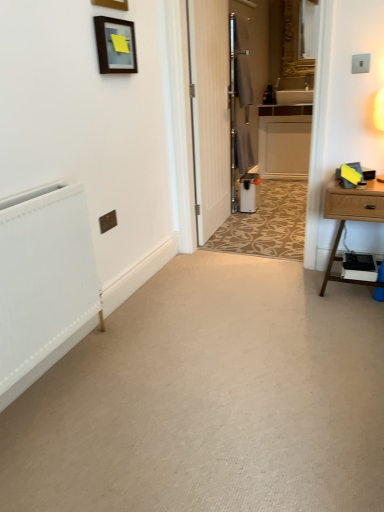
Where is `white plastic air purifier at center`? white plastic air purifier at center is located at coordinates (249, 192).

In order to face light brown wood nightstand at right, should I rotate leftwards or rightwards?

To align with it, rotate right about 21.555°.

What is the approximate height of metallic rectangular at left?

metallic rectangular at left is 3.66 inches in height.

Where is `metallic rectangular at left`? The height and width of the screenshot is (512, 384). metallic rectangular at left is located at coordinates (108, 221).

This screenshot has height=512, width=384. In order to click on gold ornate mirror at upper center in this screenshot , I will do `click(294, 42)`.

Does point (101, 1) come closer to viewer compared to point (305, 71)?

That is True.

Based on the photo, which of these two, matte wooden picture frame at upper center, placed as the second picture frame when sorted from bottom to top, or gold ornate mirror at upper center, is bigger?

gold ornate mirror at upper center is bigger.

How far apart are matte wooden picture frame at upper center, placed as the second picture frame when sorted from bottom to top, and gold ornate mirror at upper center?

They are 10.19 feet apart.

Would you say matte wooden picture frame at upper center, which is the 1th picture frame from top to bottom, is outside gold ornate mirror at upper center?

Yes, matte wooden picture frame at upper center, which is the 1th picture frame from top to bottom, is not within gold ornate mirror at upper center.

Is metallic rectangular at left at the left side of white plastic air purifier at center?

Yes, metallic rectangular at left is to the left of white plastic air purifier at center.

Based on the photo, is white plastic air purifier at center at the back of metallic rectangular at left?

metallic rectangular at left does not have its back to white plastic air purifier at center.

Considering the sizes of metallic rectangular at left and white plastic air purifier at center in the image, is metallic rectangular at left wider or thinner than white plastic air purifier at center?

metallic rectangular at left is thinner than white plastic air purifier at center.

Between metallic rectangular at left and white plastic air purifier at center, which one has smaller size?

With smaller size is metallic rectangular at left.

In terms of height, does light brown wood nightstand at right look taller or shorter compared to metallic rectangular at left?

Considering their sizes, light brown wood nightstand at right has more height than metallic rectangular at left.

Does light brown wood nightstand at right lie in front of metallic rectangular at left?

Yes, it is in front of metallic rectangular at left.

Is light brown wood nightstand at right aimed at metallic rectangular at left?

No, light brown wood nightstand at right is not facing towards metallic rectangular at left.

Visually, is light brown wood nightstand at right positioned to the left or to the right of metallic rectangular at left?

In the image, light brown wood nightstand at right appears on the right side of metallic rectangular at left.

Does gold ornate mirror at upper center turn towards white plastic air purifier at center?

No, gold ornate mirror at upper center is not aimed at white plastic air purifier at center.

Is there a large distance between gold ornate mirror at upper center and white plastic air purifier at center?

Yes, gold ornate mirror at upper center and white plastic air purifier at center are quite far apart.

Find the location of a particular element. The width and height of the screenshot is (384, 512). appliance located underneath the gold ornate mirror at upper center (from a real-world perspective) is located at coordinates (249, 192).

Is white plastic air purifier at center completely or partially inside gold ornate mirror at upper center?

No, white plastic air purifier at center is not a part of gold ornate mirror at upper center.

Considering the relative positions of light brown wood nightstand at right and white plastic air purifier at center in the image provided, is light brown wood nightstand at right behind white plastic air purifier at center?

No, it is in front of white plastic air purifier at center.

You are a GUI agent. You are given a task and a screenshot of the screen. Output one action in this format:
    pyautogui.click(x=<x>, y=<y>)
    Task: Click on the nightstand that appears on the right of white plastic air purifier at center
    The height and width of the screenshot is (512, 384).
    Given the screenshot: What is the action you would take?
    pyautogui.click(x=351, y=218)

Is white textured radiator at left not close to silver metallic screen door at center?

Yes, white textured radiator at left and silver metallic screen door at center are quite far apart.

Choose the correct answer: Is white textured radiator at left inside silver metallic screen door at center or outside it?

white textured radiator at left is located beyond the bounds of silver metallic screen door at center.

Which of these two, white textured radiator at left or silver metallic screen door at center, is bigger?

Bigger between the two is white textured radiator at left.

Which of these two, white textured radiator at left or silver metallic screen door at center, stands taller?

silver metallic screen door at center.

Is white wood cabinet at center surrounded by metallic rectangular at left?

No, white wood cabinet at center is not surrounded by metallic rectangular at left.

From the image's perspective, which one is positioned higher, metallic rectangular at left or white wood cabinet at center?

From the image's view, white wood cabinet at center is above.

Visually, is metallic rectangular at left positioned to the left or to the right of white wood cabinet at center?

Clearly, metallic rectangular at left is on the left of white wood cabinet at center in the image.

Is the position of metallic rectangular at left less distant than that of white wood cabinet at center?

Yes, metallic rectangular at left is closer to the camera.

From the image's perspective, count 1st picture frames downward from the gold ornate mirror at upper center and point to it. Please provide its 2D coordinates.

[(112, 4)]

Where is `electric outlet that appears in front of the white plastic air purifier at center`? electric outlet that appears in front of the white plastic air purifier at center is located at coordinates (108, 221).

Based on the photo, considering their positions, is metallic rectangular at left positioned closer to matte wooden picture frame at upper center, placed as the second picture frame when sorted from bottom to top, than matte black picture frame at upper left, which ranks as the 2th picture frame in top-to-bottom order?

matte black picture frame at upper left, which ranks as the 2th picture frame in top-to-bottom order, is closer to matte wooden picture frame at upper center, placed as the second picture frame when sorted from bottom to top.

Which object lies further to the anchor point silver metallic screen door at center, metallic rectangular at left or white textured radiator at left?

white textured radiator at left.

Considering their positions, is gold ornate mirror at upper center positioned closer to white plastic air purifier at center than matte wooden picture frame at upper center, placed as the second picture frame when sorted from bottom to top?

Based on the image, gold ornate mirror at upper center appears to be nearer to white plastic air purifier at center.

Looking at the image, which one is located closer to matte black picture frame at upper left, which ranks as the 2th picture frame in top-to-bottom order, metallic rectangular at left or gold ornate mirror at upper center?

metallic rectangular at left.

Which object lies nearer to the anchor point white wood cabinet at center, white textured radiator at left or light brown wood nightstand at right?

The object closer to white wood cabinet at center is light brown wood nightstand at right.

Which object lies further to the anchor point white textured radiator at left, light brown wood nightstand at right or white wood cabinet at center?

white wood cabinet at center lies further to white textured radiator at left than the other object.

Looking at the image, which one is located further to matte black picture frame at upper left, the 1th picture frame from the bottom, white wood cabinet at center or matte wooden picture frame at upper center, which is the 1th picture frame from top to bottom?

white wood cabinet at center lies further to matte black picture frame at upper left, the 1th picture frame from the bottom, than the other object.

When comparing their distances from silver metallic screen door at center, does gold ornate mirror at upper center or white textured radiator at left seem further?

white textured radiator at left is further to silver metallic screen door at center.

Identify the location of nightstand located between matte black picture frame at upper left, which ranks as the 2th picture frame in top-to-bottom order, and gold ornate mirror at upper center in the depth direction. (351, 218).

At what (x,y) coordinates should I click in order to perform the action: click on electric outlet between matte wooden picture frame at upper center, which is the 1th picture frame from top to bottom, and white textured radiator at left vertically. Please return your answer as a coordinate pair (x, y). This screenshot has width=384, height=512. Looking at the image, I should click on (108, 221).

Where is `picture frame located between matte wooden picture frame at upper center, placed as the second picture frame when sorted from bottom to top, and gold ornate mirror at upper center in the depth direction`? This screenshot has height=512, width=384. picture frame located between matte wooden picture frame at upper center, placed as the second picture frame when sorted from bottom to top, and gold ornate mirror at upper center in the depth direction is located at coordinates (115, 45).

What are the coordinates of `electric outlet between light brown wood nightstand at right and white wood cabinet at center from front to back` in the screenshot? It's located at (108, 221).